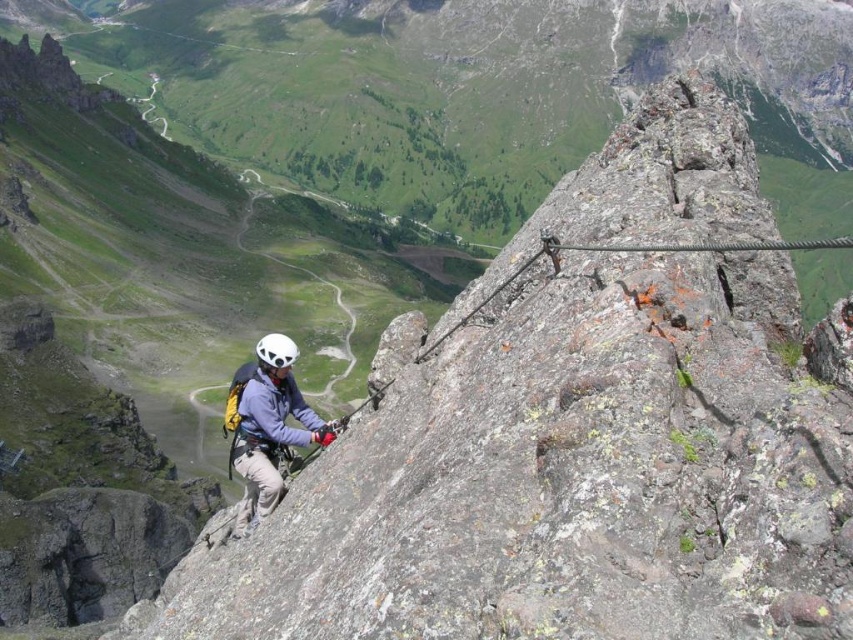
Question: Which point is farther to the camera?

Choices:
 (A) (248, 467)
 (B) (279, 362)

Answer: (B)

Question: Can you confirm if matte gray helmet at center is positioned to the left of white matte helmet at center?

Choices:
 (A) no
 (B) yes

Answer: (A)

Question: Can you confirm if matte gray helmet at center is positioned to the right of white matte helmet at center?

Choices:
 (A) yes
 (B) no

Answer: (A)

Question: Does matte gray helmet at center have a greater width compared to white matte helmet at center?

Choices:
 (A) no
 (B) yes

Answer: (A)

Question: Which object is farther from the camera taking this photo?

Choices:
 (A) matte gray helmet at center
 (B) white matte helmet at center

Answer: (B)